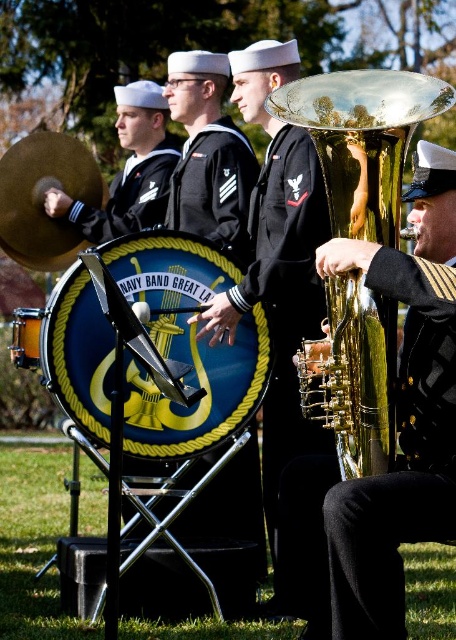
You are a photographer trying to capture a clear photo of the shiny black drum at center without the gold shiny tuba at right blocking it. Based on the scene description, is this possible? Explain why or why not.

The gold shiny tuba at right is in front of the shiny black drum at center, so it will block the view. To capture the drum without the tuba blocking it, you would need to reposition yourself or the subjects so the tuba is no longer in front of the drum.

You are a photographer standing at the center of the park. You want to take a photo of the gold shiny tuba at right. According to the coordinates given, where should you aim your camera to capture it?

You should aim your camera at point 0.219 on the x axis and 0.794 on the y axis to capture the gold shiny tuba at right.

You are standing 5 meters away from the point at coordinates point [321,80]. Can you reach it without moving closer?

The point [321,80] is 4.64 meters away from the viewer, so you are currently 5 meters away. Therefore, you cannot reach it without moving closer since you are farther away than the point.